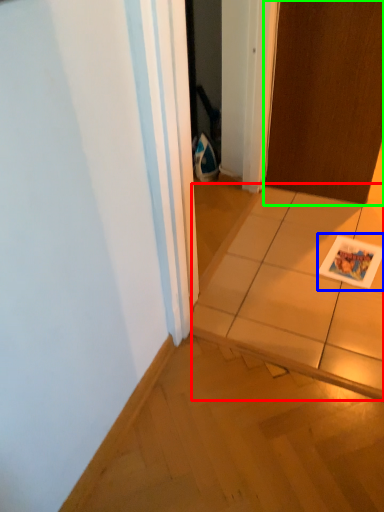
Question: Based on their relative distances, which object is nearer to tile (highlighted by a red box)? Choose from postcard (highlighted by a blue box) and door (highlighted by a green box).

Choices:
 (A) postcard
 (B) door

Answer: (A)